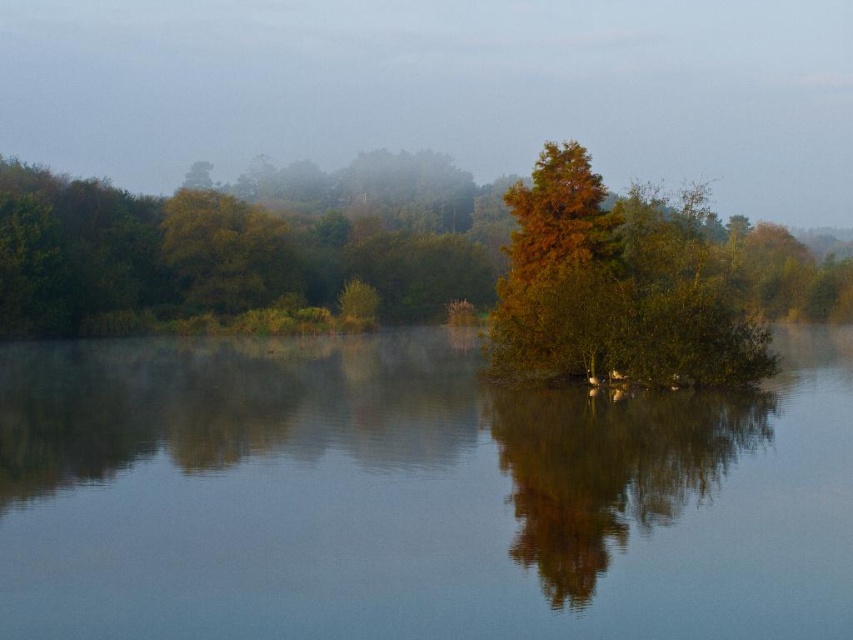
Does transparent water at center have a smaller size compared to orange matte tree at center?

Yes.

Is transparent water at center closer to the viewer compared to orange matte tree at center?

That is True.

Locate an element on the screen. This screenshot has width=853, height=640. transparent water at center is located at coordinates (415, 497).

Locate an element on the screen. Image resolution: width=853 pixels, height=640 pixels. transparent water at center is located at coordinates (415, 497).

Is point (59, 352) positioned in front of point (635, 500)?

No, it is not.

Is transparent water at center positioned behind brown matte tree at center?

No.

Is point (469, 438) positioned before point (561, 481)?

That is False.

The width and height of the screenshot is (853, 640). I want to click on transparent water at center, so click(x=415, y=497).

Which is in front, point (605, 324) or point (556, 486)?

Point (556, 486) is in front.

In the scene shown: Is orange matte tree at center taller than brown matte tree at center?

Yes.

Which is in front, point (498, 288) or point (750, 422)?

Point (750, 422) is in front.

Where is `orange matte tree at center`? The height and width of the screenshot is (640, 853). orange matte tree at center is located at coordinates (616, 288).